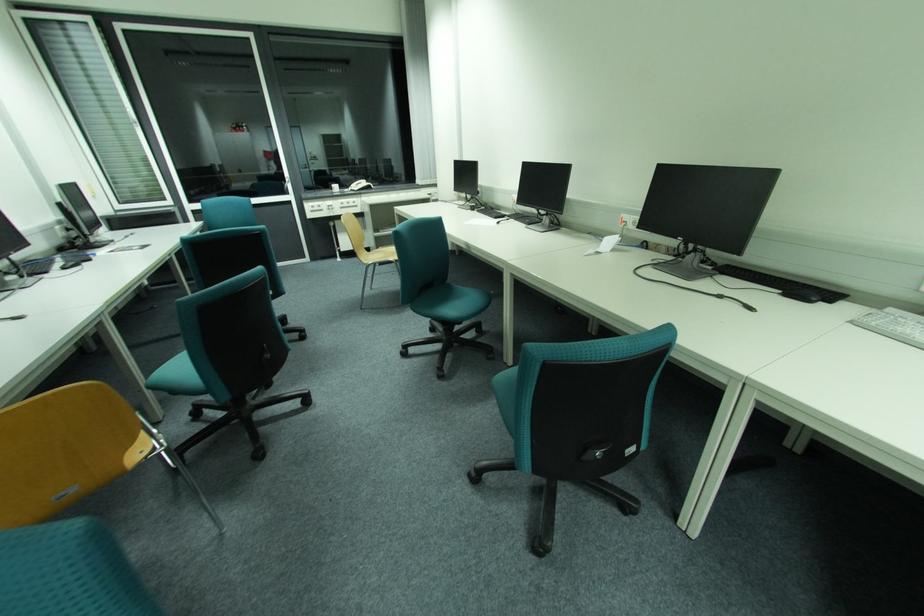
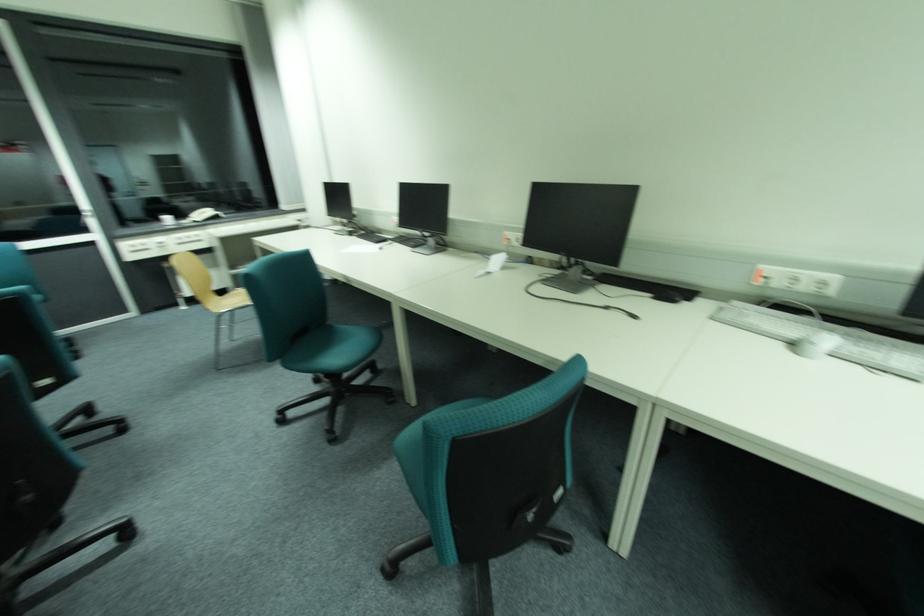
Locate, in the second image, the point that corresponds to (598,251) in the first image.

(487, 272)